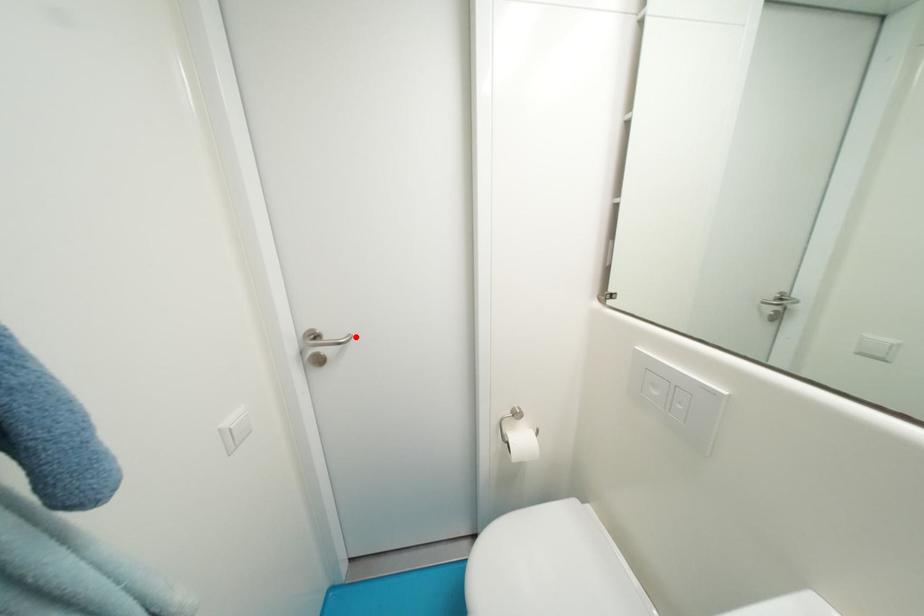
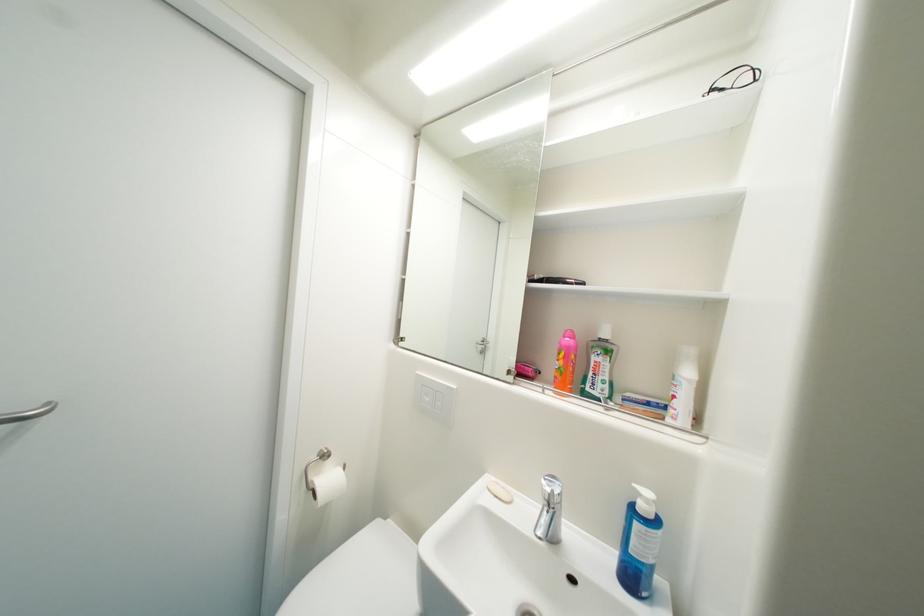
Where in the second image is the point corresponding to the highlighted location from the first image?

(55, 405)